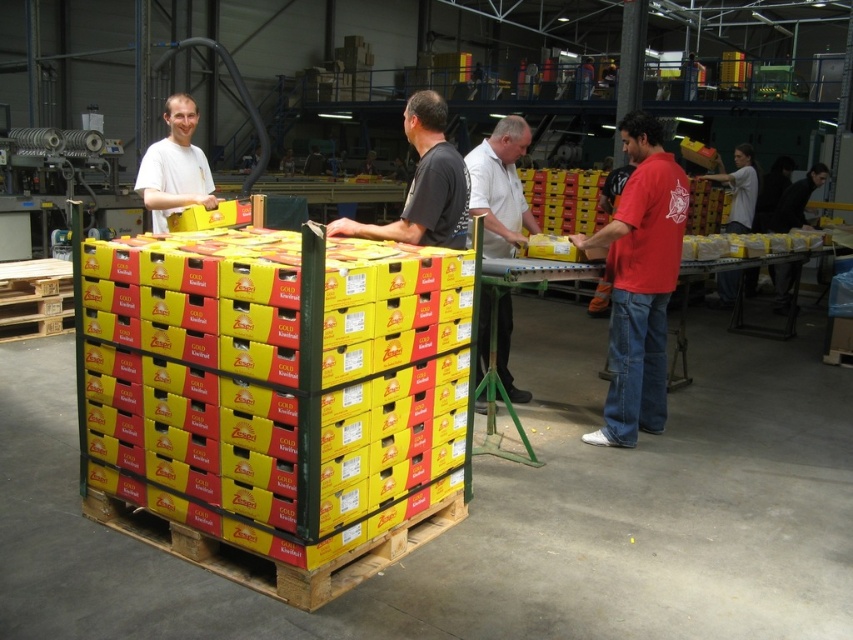
Measure the distance from red cotton shirt at right to matte white shirt at left.

red cotton shirt at right and matte white shirt at left are 8.10 feet apart.

Does red cotton shirt at right appear on the right side of matte white shirt at left?

Yes, red cotton shirt at right is to the right of matte white shirt at left.

Between point (663, 236) and point (196, 116), which one is positioned behind?

Point (196, 116)

Locate an element on the screen. The height and width of the screenshot is (640, 853). red cotton shirt at right is located at coordinates (639, 282).

Is the position of white matte shirt at center more distant than that of matte white shirt at left?

No, white matte shirt at center is in front of matte white shirt at left.

Is white matte shirt at center shorter than matte white shirt at left?

In fact, white matte shirt at center may be taller than matte white shirt at left.

Which is in front, point (497, 232) or point (175, 156)?

Point (175, 156) is in front.

I want to click on white matte shirt at center, so click(x=500, y=188).

Who is shorter, white matte shirt at center or dark gray shirt at center?

dark gray shirt at center

Locate an element on the screen. The image size is (853, 640). white matte shirt at center is located at coordinates (500, 188).